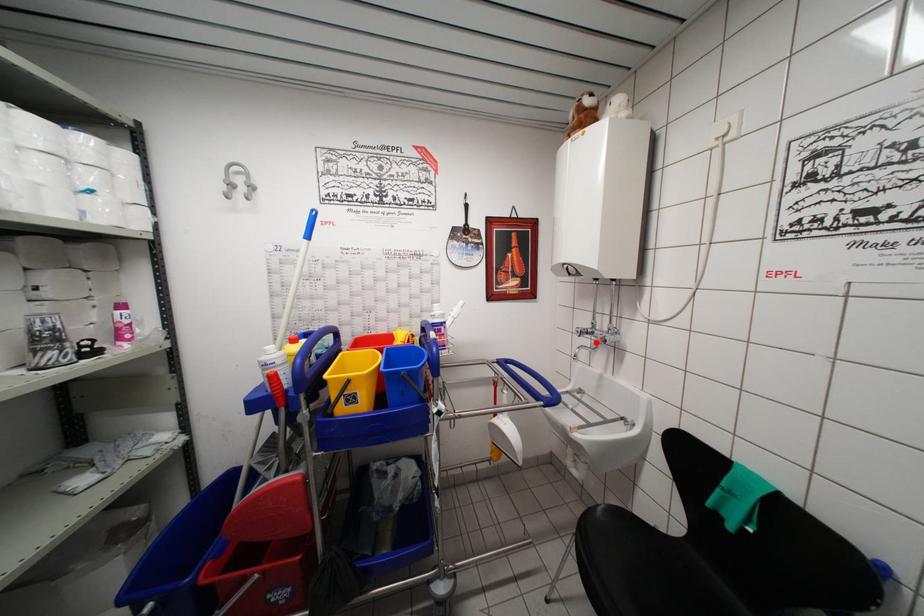
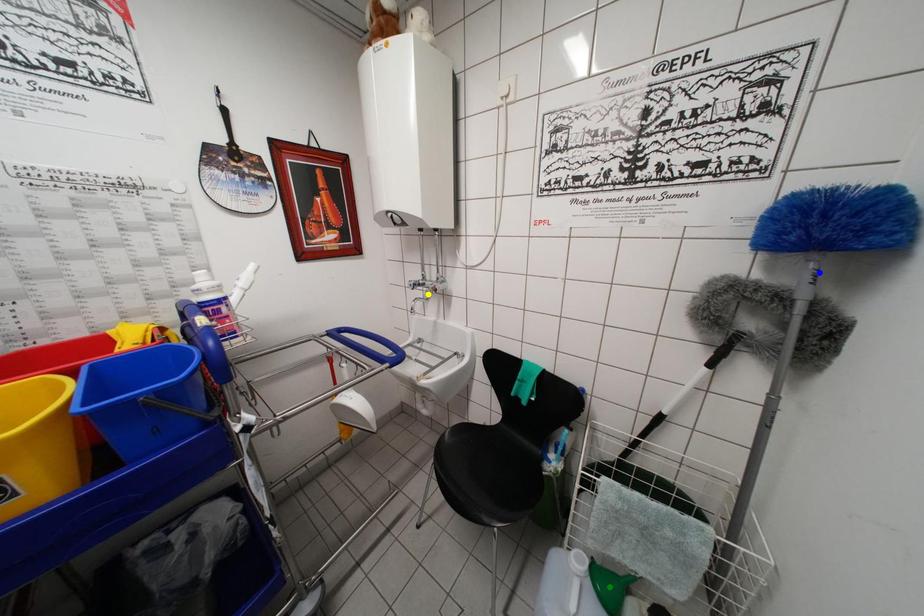
Question: I am providing you with two images of the same scene from different viewpoints. A red point is marked on the first image. You are given multiple points on the second image. Which point in image 2 is actually the same real-world point as the red point in image 1?

Choices:
 (A) blue point
 (B) yellow point
 (C) green point

Answer: (B)